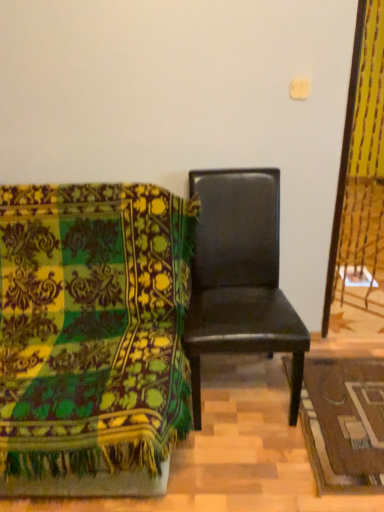
Question: Is velvet green chair at left, arranged as the first chair when viewed from the left, aimed at black leather chair at center, the 2th chair from the left?

Choices:
 (A) no
 (B) yes

Answer: (A)

Question: Is velvet green chair at left, arranged as the first chair when viewed from the left, further to camera compared to black leather chair at center, the 2th chair from the left?

Choices:
 (A) yes
 (B) no

Answer: (B)

Question: Does velvet green chair at left, arranged as the first chair when viewed from the left, have a greater width compared to black leather chair at center, which is counted as the first chair, starting from the right?

Choices:
 (A) yes
 (B) no

Answer: (A)

Question: Considering the relative positions of velvet green chair at left, arranged as the first chair when viewed from the left, and black leather chair at center, the 2th chair from the left, in the image provided, is velvet green chair at left, arranged as the first chair when viewed from the left, in front of black leather chair at center, the 2th chair from the left,?

Choices:
 (A) no
 (B) yes

Answer: (B)

Question: Is velvet green chair at left, arranged as the first chair when viewed from the left, located outside black leather chair at center, the 2th chair from the left?

Choices:
 (A) no
 (B) yes

Answer: (B)

Question: Considering the positions of velvet green chair at left, arranged as the 2th chair when viewed from the right, and black leather chair at center, which is counted as the first chair, starting from the right, in the image, is velvet green chair at left, arranged as the 2th chair when viewed from the right, bigger or smaller than black leather chair at center, which is counted as the first chair, starting from the right,?

Choices:
 (A) small
 (B) big

Answer: (B)

Question: Is velvet green chair at left, arranged as the first chair when viewed from the left, wider or thinner than black leather chair at center, which is counted as the first chair, starting from the right?

Choices:
 (A) thin
 (B) wide

Answer: (B)

Question: In the image, is velvet green chair at left, arranged as the first chair when viewed from the left, positioned in front of or behind black leather chair at center, the 2th chair from the left?

Choices:
 (A) front
 (B) behind

Answer: (A)

Question: Choose the correct answer: Is velvet green chair at left, arranged as the 2th chair when viewed from the right, inside black leather chair at center, which is counted as the first chair, starting from the right, or outside it?

Choices:
 (A) outside
 (B) inside

Answer: (A)

Question: Relative to brown woven mat at lower right, is velvet green chair at left, arranged as the 2th chair when viewed from the right, in front or behind?

Choices:
 (A) front
 (B) behind

Answer: (A)

Question: In the image, is velvet green chair at left, arranged as the 2th chair when viewed from the right, on the left side or the right side of brown woven mat at lower right?

Choices:
 (A) right
 (B) left

Answer: (B)

Question: Is velvet green chair at left, arranged as the first chair when viewed from the left, taller or shorter than brown woven mat at lower right?

Choices:
 (A) tall
 (B) short

Answer: (A)

Question: Based on their sizes in the image, would you say velvet green chair at left, arranged as the 2th chair when viewed from the right, is bigger or smaller than brown woven mat at lower right?

Choices:
 (A) small
 (B) big

Answer: (B)

Question: In the image, is brown woven mat at lower right positioned in front of or behind black leather chair at center, which is counted as the first chair, starting from the right?

Choices:
 (A) behind
 (B) front

Answer: (A)

Question: In terms of size, does brown woven mat at lower right appear bigger or smaller than black leather chair at center, the 2th chair from the left?

Choices:
 (A) small
 (B) big

Answer: (A)